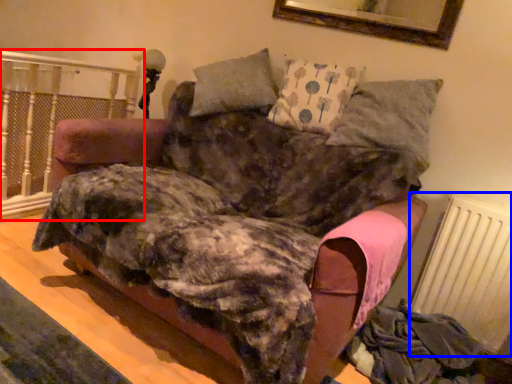
Question: Among these objects, which one is farthest to the camera, rail (highlighted by a red box) or radiator (highlighted by a blue box)?

Choices:
 (A) rail
 (B) radiator

Answer: (A)